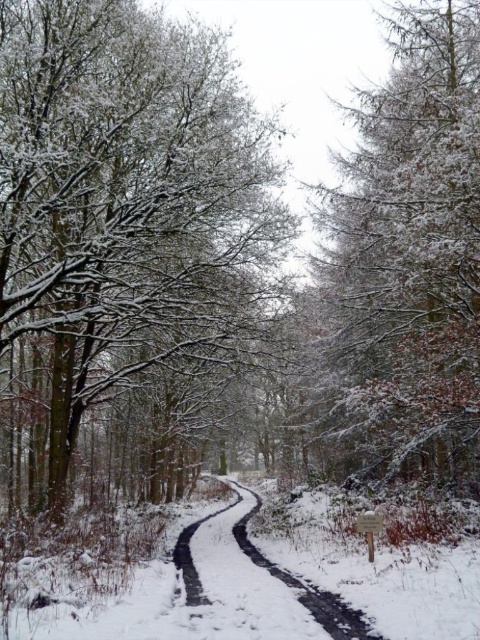
Question: Considering the relative positions of snow-covered branches at center and snow-covered evergreen tree at right in the image provided, where is snow-covered branches at center located with respect to snow-covered evergreen tree at right?

Choices:
 (A) right
 (B) left

Answer: (B)

Question: In this image, where is snow-covered branches at center located relative to snow-covered evergreen tree at right?

Choices:
 (A) above
 (B) below

Answer: (B)

Question: Can you confirm if snow-covered branches at center is positioned to the left of snow-covered evergreen tree at right?

Choices:
 (A) no
 (B) yes

Answer: (B)

Question: Which object is farther from the camera taking this photo?

Choices:
 (A) snow-covered evergreen tree at right
 (B) snow-covered branches at center

Answer: (A)